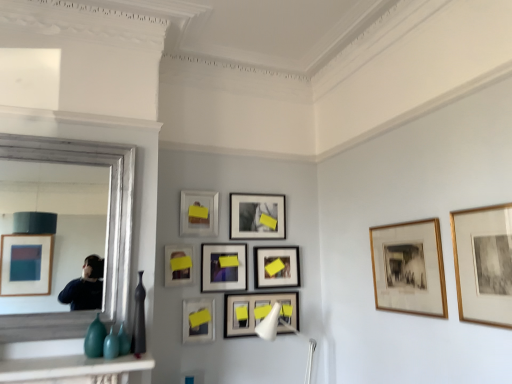
The height and width of the screenshot is (384, 512). Find the location of `free spot above gold-framed print at center-right, marked as the 8th picture frame in a back-to-front arrangement (from a real-world perspective)`. free spot above gold-framed print at center-right, marked as the 8th picture frame in a back-to-front arrangement (from a real-world perspective) is located at coordinates (402, 220).